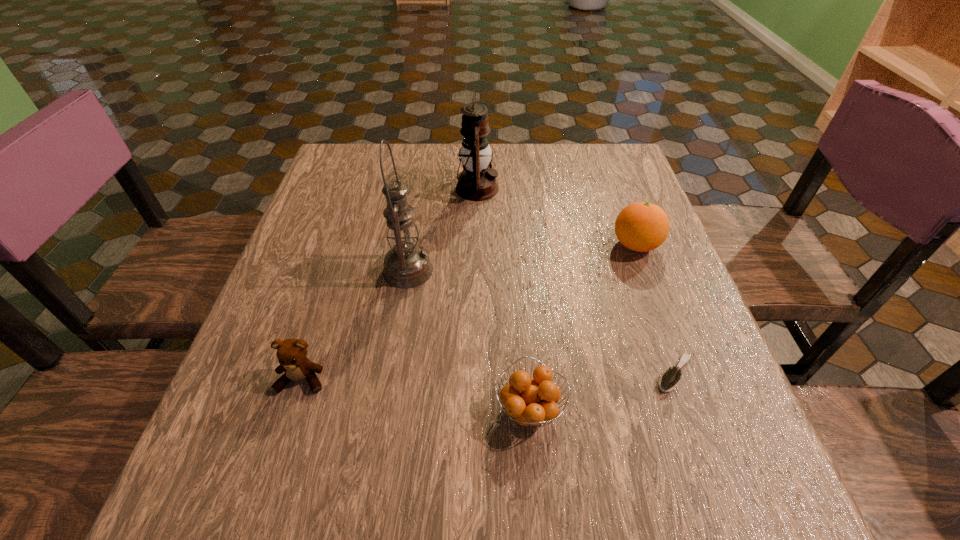
Where is `free space located on the side of the farthest object, there is a wick adjustment knob`? free space located on the side of the farthest object, there is a wick adjustment knob is located at coordinates (529, 188).

Locate an element on the screen. Image resolution: width=960 pixels, height=540 pixels. blank area located on the left of the farther orange fruit is located at coordinates (522, 245).

What are the coordinates of `free space located 0.270m on the back of the left orange fruit` in the screenshot? It's located at (517, 268).

Where is `vacant space located 0.160m on the front of the scrubbing brush`? The image size is (960, 540). vacant space located 0.160m on the front of the scrubbing brush is located at coordinates (718, 496).

Identify the location of object that is at the far edge. This screenshot has height=540, width=960. (477, 182).

The height and width of the screenshot is (540, 960). I want to click on object that is at the left edge, so click(291, 353).

Locate an element on the screen. This screenshot has height=540, width=960. orange located at the right edge is located at coordinates (641, 227).

Find the location of a particular element. Image resolution: width=960 pixels, height=540 pixels. scrubbing brush that is at the right edge is located at coordinates (670, 379).

Identify the location of blank space at the far edge of the desktop. The width and height of the screenshot is (960, 540). point(527,164).

The width and height of the screenshot is (960, 540). Find the location of `vacant space at the near edge`. vacant space at the near edge is located at coordinates (352, 491).